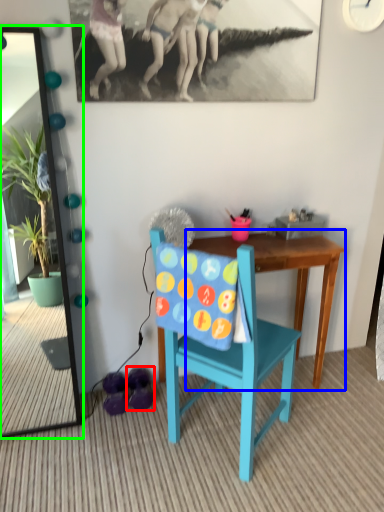
Question: Based on their relative distances, which object is farther from footwear (highlighted by a red box)? Choose from table (highlighted by a blue box) and mirror (highlighted by a green box).

Choices:
 (A) table
 (B) mirror

Answer: (B)